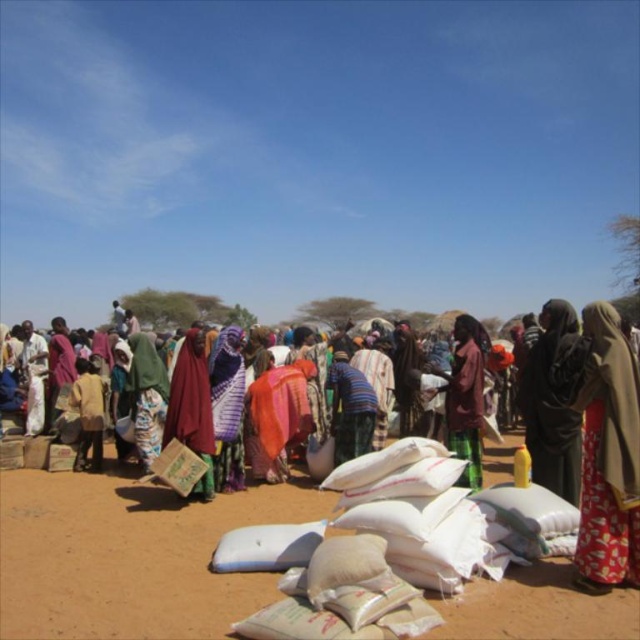
Does brown sandbags at center have a larger size compared to matte purple scarf at center?

Actually, brown sandbags at center might be smaller than matte purple scarf at center.

Where is `brown sandbags at center`? brown sandbags at center is located at coordinates (129, 556).

Who is positioned more to the left, brown sandbags at center or dark brown fabric headscarf at center?

brown sandbags at center is more to the left.

Who is more forward, (540, 614) or (532, 468)?

Positioned in front is point (540, 614).

The width and height of the screenshot is (640, 640). I want to click on brown sandbags at center, so click(x=129, y=556).

Which is more to the right, printed cotton dress at lower right or dark brown fabric headscarf at center?

From the viewer's perspective, dark brown fabric headscarf at center appears more on the right side.

Is printed cotton dress at lower right positioned before dark brown fabric headscarf at center?

Yes, it is in front of dark brown fabric headscarf at center.

This screenshot has height=640, width=640. I want to click on printed cotton dress at lower right, so click(x=609, y=456).